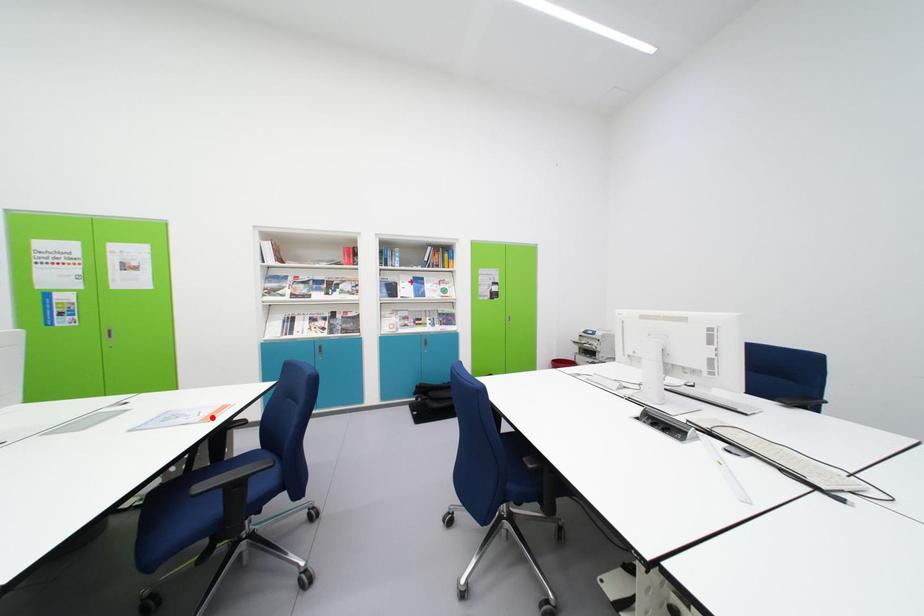
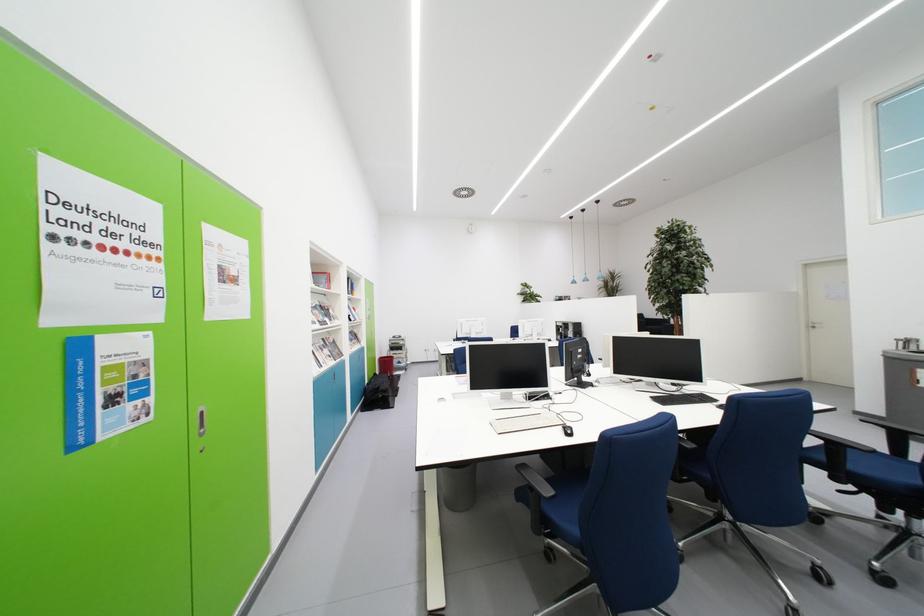
Question: I am providing you with two images of the same scene from different viewpoints. A red point is marked on the first image. Can you still see the location of the red point in image 2?

Choices:
 (A) Yes
 (B) No

Answer: (B)